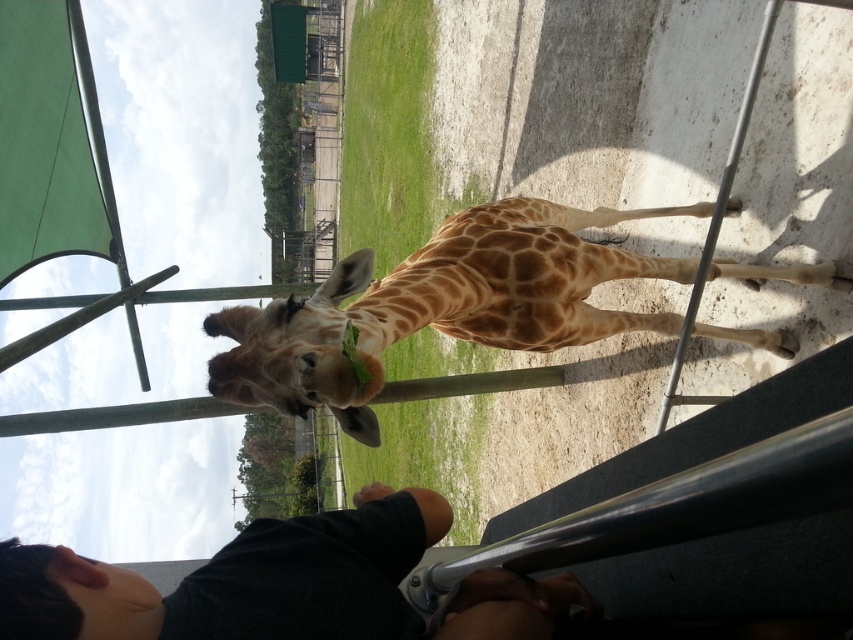
Question: Which object appears closest to the camera in this image?

Choices:
 (A) spotted fur giraffe at center
 (B) black skin at lower left

Answer: (B)

Question: Is dark gray shirt at lower center to the right of black skin at lower left from the viewer's perspective?

Choices:
 (A) yes
 (B) no

Answer: (A)

Question: Is spotted fur giraffe at center to the right of dark gray shirt at lower center from the viewer's perspective?

Choices:
 (A) yes
 (B) no

Answer: (A)

Question: Among these points, which one is nearest to the camera?

Choices:
 (A) (268, 614)
 (B) (123, 577)

Answer: (A)

Question: Does spotted fur giraffe at center lie behind dark gray shirt at lower center?

Choices:
 (A) yes
 (B) no

Answer: (A)

Question: Among these points, which one is nearest to the camera?

Choices:
 (A) (515, 196)
 (B) (463, 620)
 (C) (105, 611)

Answer: (B)